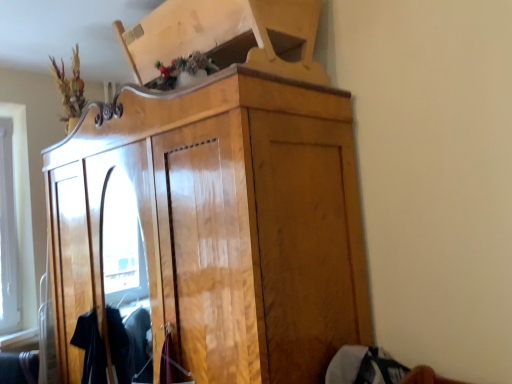
Question: Is gray cotton sweater at lower right looking in the opposite direction of glossy wood cupboard at center?

Choices:
 (A) yes
 (B) no

Answer: (B)

Question: Does gray cotton sweater at lower right have a greater height compared to glossy wood cupboard at center?

Choices:
 (A) no
 (B) yes

Answer: (A)

Question: Could you tell me if gray cotton sweater at lower right is facing glossy wood cupboard at center?

Choices:
 (A) no
 (B) yes

Answer: (A)

Question: Is glossy wood cupboard at center surrounded by gray cotton sweater at lower right?

Choices:
 (A) no
 (B) yes

Answer: (A)

Question: Is gray cotton sweater at lower right shorter than glossy wood cupboard at center?

Choices:
 (A) yes
 (B) no

Answer: (A)

Question: Would you consider gray cotton sweater at lower right to be distant from glossy wood cupboard at center?

Choices:
 (A) no
 (B) yes

Answer: (A)

Question: Is glossy wood cupboard at center oriented away from gray cotton sweater at lower right?

Choices:
 (A) no
 (B) yes

Answer: (A)

Question: Does glossy wood cupboard at center have a lesser width compared to gray cotton sweater at lower right?

Choices:
 (A) yes
 (B) no

Answer: (B)

Question: Is glossy wood cupboard at center to the left of gray cotton sweater at lower right from the viewer's perspective?

Choices:
 (A) no
 (B) yes

Answer: (B)

Question: Is glossy wood cupboard at center next to gray cotton sweater at lower right?

Choices:
 (A) no
 (B) yes

Answer: (A)

Question: Could you tell me if glossy wood cupboard at center is facing gray cotton sweater at lower right?

Choices:
 (A) no
 (B) yes

Answer: (A)

Question: From a real-world perspective, is glossy wood cupboard at center under gray cotton sweater at lower right?

Choices:
 (A) no
 (B) yes

Answer: (A)

Question: Which is correct: glossy wood cupboard at center is inside gray cotton sweater at lower right, or outside of it?

Choices:
 (A) outside
 (B) inside

Answer: (A)